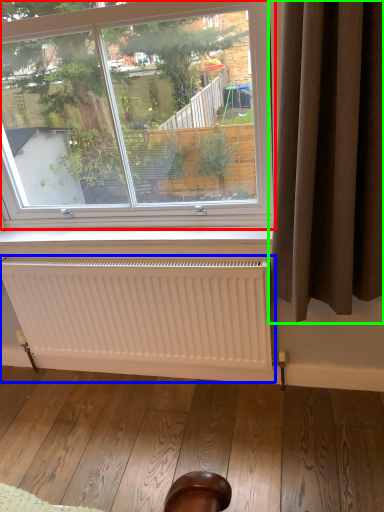
Question: Considering the real-world distances, which object is farthest from window (highlighted by a red box)? radiator (highlighted by a blue box) or curtain (highlighted by a green box)?

Choices:
 (A) radiator
 (B) curtain

Answer: (A)